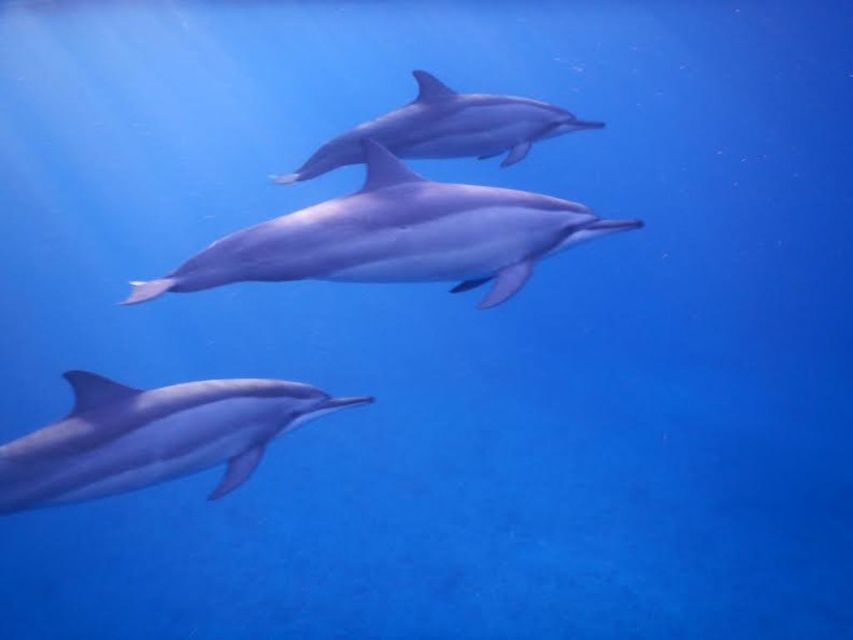
Question: Which point is closer to the camera taking this photo?

Choices:
 (A) (80, 458)
 (B) (427, 186)
 (C) (567, 115)

Answer: (A)

Question: Which point is closer to the camera taking this photo?

Choices:
 (A) (521, 154)
 (B) (7, 470)

Answer: (B)

Question: Can you confirm if sleek blue dolphin at lower left is positioned to the left of smooth skin dolphin at center?

Choices:
 (A) no
 (B) yes

Answer: (B)

Question: Does smooth gray dolphin at center appear on the left side of sleek blue dolphin at lower left?

Choices:
 (A) yes
 (B) no

Answer: (B)

Question: Is the position of smooth gray dolphin at center more distant than that of smooth skin dolphin at center?

Choices:
 (A) no
 (B) yes

Answer: (A)

Question: Which object appears farthest from the camera in this image?

Choices:
 (A) smooth gray dolphin at center
 (B) sleek blue dolphin at lower left

Answer: (A)